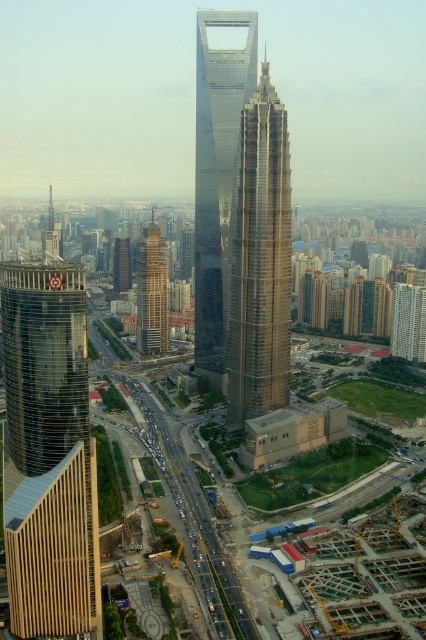
Which is more to the left, glassy metallic skyscraper at center or brown textured building at center?

From the viewer's perspective, brown textured building at center appears more on the left side.

Between glassy metallic skyscraper at center and brown textured building at center, which one is positioned higher?

glassy metallic skyscraper at center is above.

This screenshot has width=426, height=640. I want to click on glassy metallic skyscraper at center, so click(218, 172).

Is gold reflective skyscraper at center positioned at the back of white glass building at center?

No, gold reflective skyscraper at center is closer to the viewer.

Does gold reflective skyscraper at center appear on the left side of white glass building at center?

Yes, gold reflective skyscraper at center is to the left of white glass building at center.

Is point (239, 230) positioned in front of point (393, 317)?

That is True.

You are a GUI agent. You are given a task and a screenshot of the screen. Output one action in this format:
    pyautogui.click(x=<x>, y=<y>)
    Task: Click on the gold reflective skyscraper at center
    The image size is (426, 640).
    Given the screenshot: What is the action you would take?
    pyautogui.click(x=261, y=260)

Who is higher up, gold reflective skyscraper at center or dark brown glass building at center?

dark brown glass building at center is higher up.

Between gold reflective skyscraper at center and dark brown glass building at center, which one appears on the right side from the viewer's perspective?

gold reflective skyscraper at center is more to the right.

The height and width of the screenshot is (640, 426). What do you see at coordinates (261, 260) in the screenshot?
I see `gold reflective skyscraper at center` at bounding box center [261, 260].

Locate an element on the screen. Image resolution: width=426 pixels, height=640 pixels. gold reflective skyscraper at center is located at coordinates (261, 260).